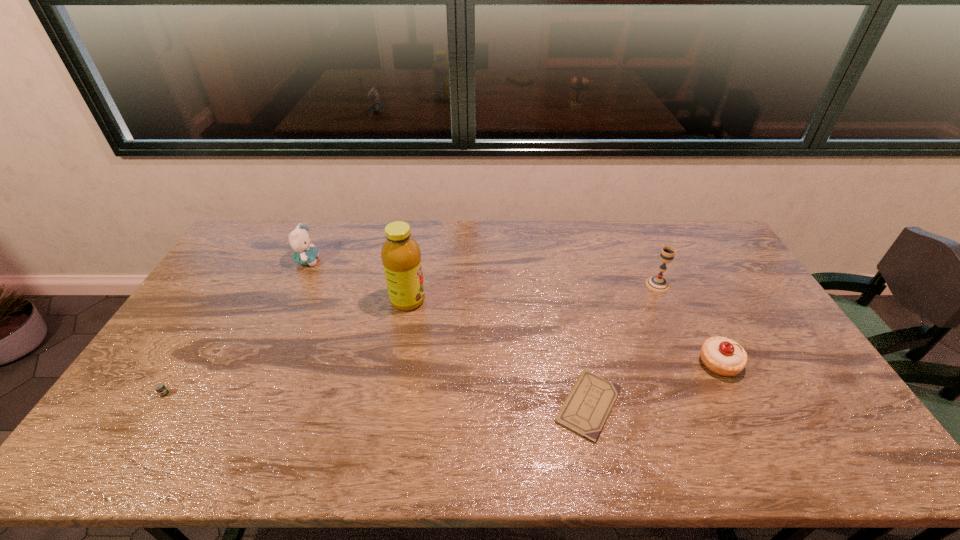
I want to click on the fourth object from right to left, so click(x=401, y=256).

In order to click on the tallest object in this screenshot , I will do `click(401, 256)`.

Locate an element on the screen. This screenshot has width=960, height=540. chalice is located at coordinates (656, 283).

This screenshot has height=540, width=960. Identify the location of kitten. (299, 239).

In order to click on the farthest object in this screenshot , I will do `click(299, 239)`.

Locate an element on the screen. This screenshot has height=540, width=960. pastry is located at coordinates (723, 356).

What are the coordinates of `beer can` in the screenshot? It's located at (160, 388).

Locate an element on the screen. the second shortest object is located at coordinates (160, 388).

This screenshot has height=540, width=960. Identify the location of the fourth object from left to right. (588, 405).

Locate an element on the screen. Image resolution: width=960 pixels, height=540 pixels. the shortest object is located at coordinates (588, 405).